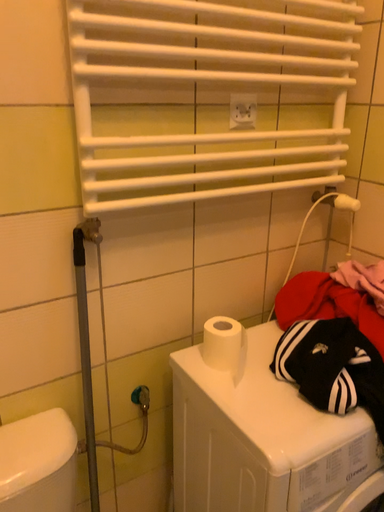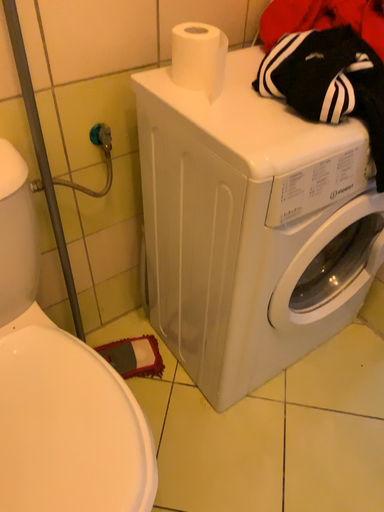
Question: Which way did the camera rotate in the video?

Choices:
 (A) rotated downward
 (B) rotated upward

Answer: (A)